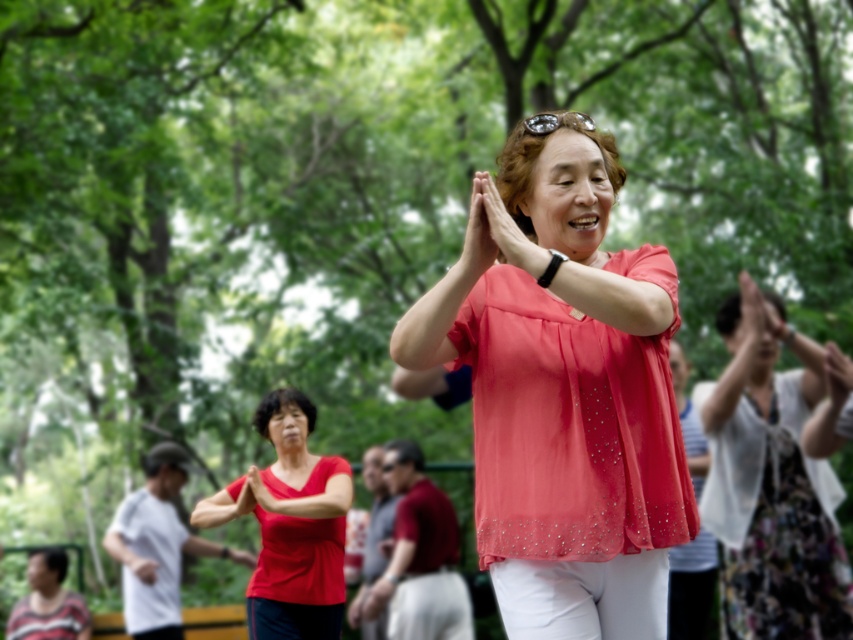
You are standing in the park and see two people wearing different tops, the floral dress at center and the matte red blouse at center. Which one appears closer to you?

The floral dress at center appears closer to you because it is further to the viewer than the matte red blouse at center.

You are organizing a fashion show and need to arrange two blouses on a mannequin. The matte pink blouse at center and the matte red blouse at center are both available. If you want to display the smaller one on the left side of the mannequin, which blouse should you choose?

The matte pink blouse at center has a smaller size compared to the matte red blouse at center, so you should choose the matte pink blouse at center to display on the left side of the mannequin.